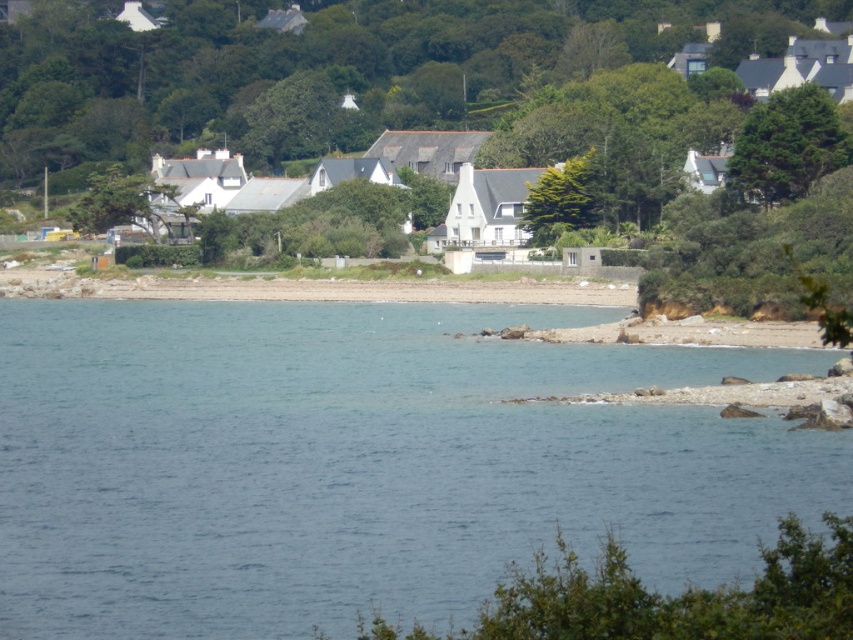
Between green textured tree at upper right and green leafy tree at center, which one is positioned higher?

green textured tree at upper right is above.

What do you see at coordinates (787, 145) in the screenshot?
I see `green textured tree at upper right` at bounding box center [787, 145].

Where is `green textured tree at upper right`? green textured tree at upper right is located at coordinates (787, 145).

Who is shorter, blue water at center or green textured tree at upper right?

blue water at center is shorter.

Does blue water at center have a smaller size compared to green textured tree at upper right?

Incorrect, blue water at center is not smaller in size than green textured tree at upper right.

Does point (32, 499) come in front of point (837, 154)?

Yes, point (32, 499) is in front of point (837, 154).

The width and height of the screenshot is (853, 640). What are the coordinates of `blue water at center` in the screenshot? It's located at 358,464.

Is point (427, 435) behind point (570, 177)?

No, it is not.

Which of these two, blue water at center or green leafy tree at center, stands taller?

blue water at center

Does point (782, 497) come in front of point (560, 198)?

Yes, it is in front of point (560, 198).

The width and height of the screenshot is (853, 640). I want to click on blue water at center, so (x=358, y=464).